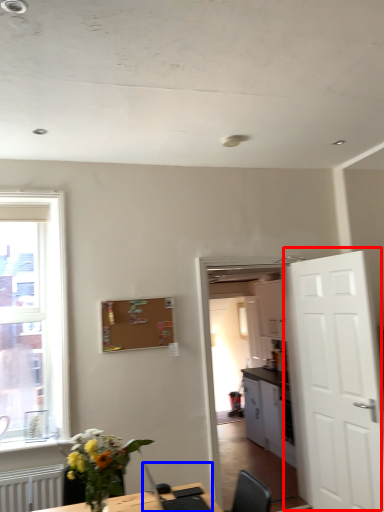
Question: Which object is further to the camera taking this photo, door (highlighted by a red box) or computer (highlighted by a blue box)?

Choices:
 (A) door
 (B) computer

Answer: (A)